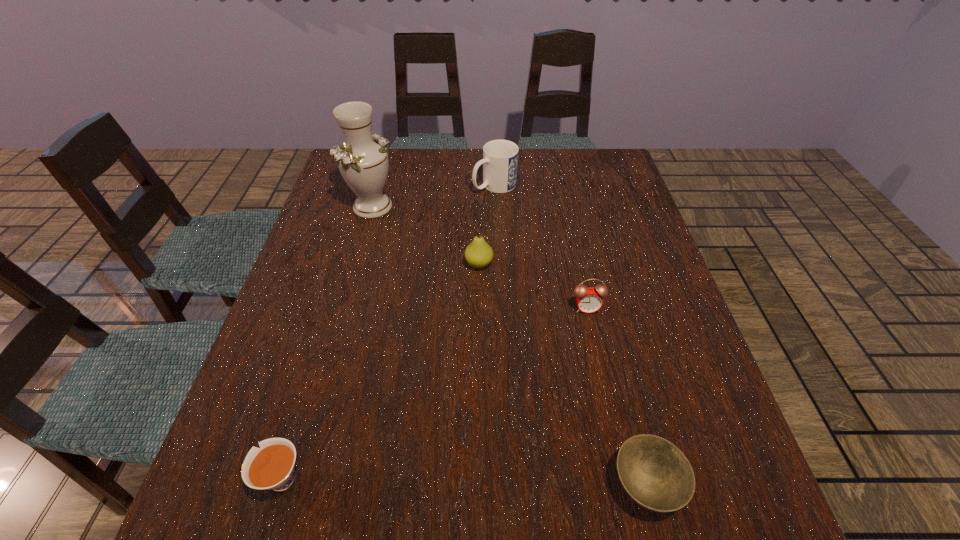
Identify the location of the tallest object. This screenshot has width=960, height=540. (363, 161).

Where is `mug`? mug is located at coordinates (500, 157).

Where is `the third farthest object`? The height and width of the screenshot is (540, 960). the third farthest object is located at coordinates (478, 254).

Locate an element on the screen. This screenshot has height=540, width=960. the fourth farthest object is located at coordinates (589, 299).

Where is `the fourth tallest object`? The width and height of the screenshot is (960, 540). the fourth tallest object is located at coordinates (589, 299).

Find the location of a particular element. The width and height of the screenshot is (960, 540). teacup is located at coordinates (271, 467).

At what (x,y) coordinates should I click in order to perform the action: click on bowl. Please return your answer as a coordinate pair (x, y). The image size is (960, 540). Looking at the image, I should click on (654, 472).

Where is `vacant position located 0.320m on the front of the vase`? vacant position located 0.320m on the front of the vase is located at coordinates (344, 309).

The height and width of the screenshot is (540, 960). I want to click on free spot located 0.340m on the right of the mug, so click(625, 185).

Locate an element on the screen. The width and height of the screenshot is (960, 540). vacant space located 0.070m on the left of the fourth nearest object is located at coordinates (438, 264).